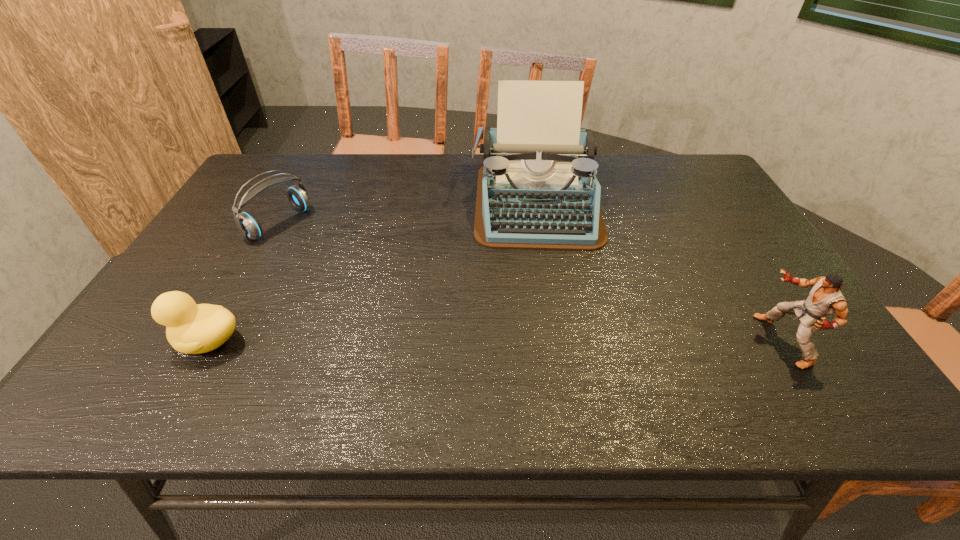
This screenshot has width=960, height=540. What are the coordinates of `unoccupied position between the third object from left to right and the duck` in the screenshot? It's located at (372, 272).

You are a GUI agent. You are given a task and a screenshot of the screen. Output one action in this format:
    pyautogui.click(x=<x>, y=<y>)
    Task: Click on the empty space between the third shortest object and the headset
    The width and height of the screenshot is (960, 540).
    Given the screenshot: What is the action you would take?
    pyautogui.click(x=531, y=282)

You are a GUI agent. You are given a task and a screenshot of the screen. Output one action in this format:
    pyautogui.click(x=<x>, y=<y>)
    Task: Click on the free space between the second tallest object and the duck
    The height and width of the screenshot is (540, 960).
    Given the screenshot: What is the action you would take?
    pyautogui.click(x=495, y=341)

Identify the location of unoccupied position between the typewriter and the duck. (372, 272).

This screenshot has height=540, width=960. In order to click on vacant space that is in between the duck and the tallest object in this screenshot , I will do `click(372, 272)`.

Find the location of a particular element. The height and width of the screenshot is (540, 960). vacant space that is in between the third object from left to right and the headset is located at coordinates (408, 213).

Locate an element on the screen. free space that is in between the duck and the headset is located at coordinates (244, 282).

I want to click on free space between the rightmost object and the duck, so click(495, 341).

Identify which object is the third nearest to the typewriter. Please provide its 2D coordinates. Your answer should be formatted as a tuple, i.e. [(x, y)], where the tuple contains the x and y coordinates of a point satisfying the conditions above.

[(191, 328)]

Identify which object is located as the nearest to the headset. Please provide its 2D coordinates. Your answer should be formatted as a tuple, i.e. [(x, y)], where the tuple contains the x and y coordinates of a point satisfying the conditions above.

[(191, 328)]